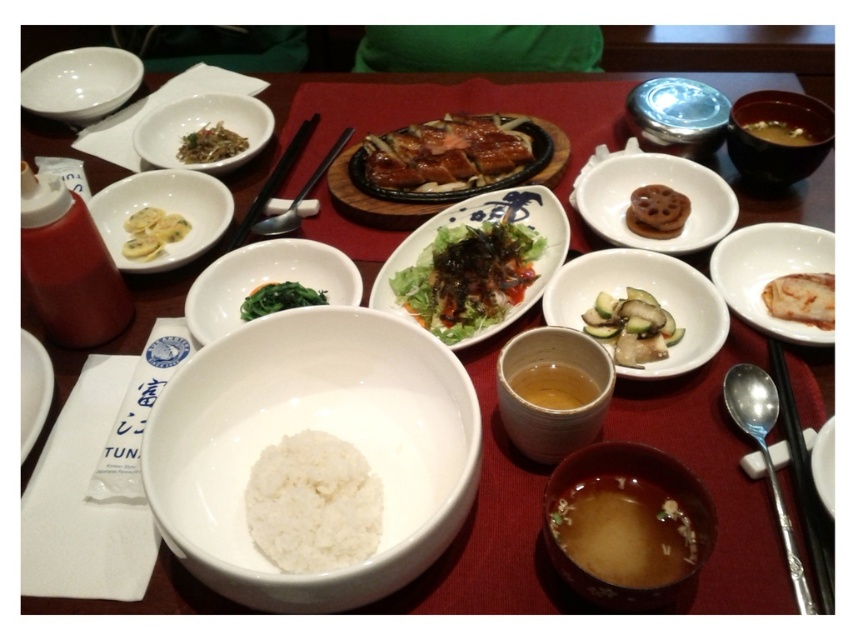
Question: Which object appears closest to the camera in this image?

Choices:
 (A) translucent ceramic cup at center
 (B) matte ceramic cup at center
 (C) white glossy sliced vegetables at center
 (D) black plastic chopsticks at center

Answer: (B)

Question: Considering the relative positions of white glossy sliced vegetables at center and white matte plate at lower left in the image provided, where is white glossy sliced vegetables at center located with respect to white matte plate at lower left?

Choices:
 (A) below
 (B) above

Answer: (B)

Question: Which of the following is the farthest from the observer?

Choices:
 (A) (254, 486)
 (B) (126, 259)
 (C) (824, 138)

Answer: (C)

Question: Is the position of matte ceramic cup at center more distant than that of green leafy vegetable at center?

Choices:
 (A) no
 (B) yes

Answer: (A)

Question: Can you confirm if brown matte cookie at upper right is thinner than yellowish translucent soup at upper right?

Choices:
 (A) no
 (B) yes

Answer: (B)

Question: Which point is farther to the camera?

Choices:
 (A) white matte dumplings at center left
 (B) white ceramic bowl at center
 (C) brown ceramic bowl at lower center
 (D) yellowish translucent soup at upper right

Answer: (D)